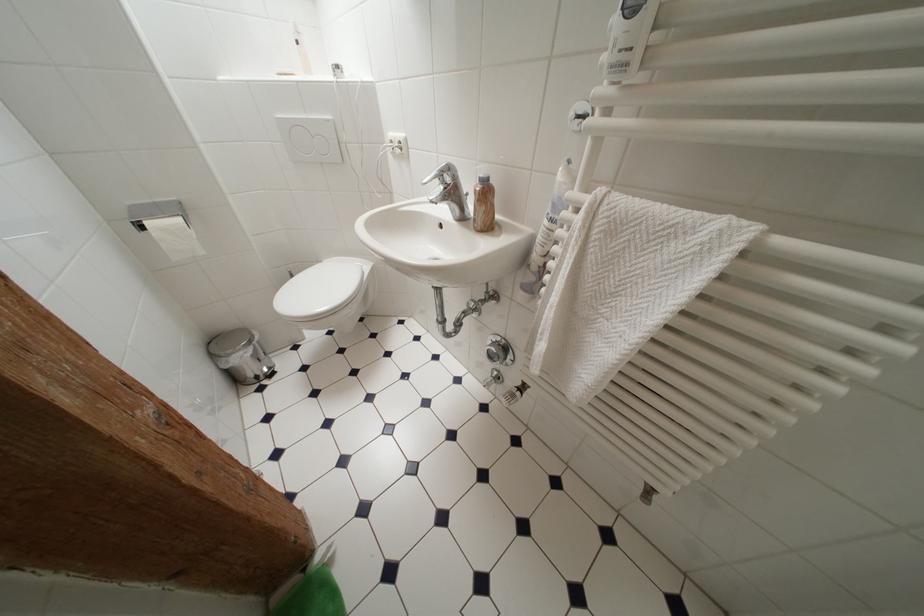
Where is `white toilet lid`? white toilet lid is located at coordinates (319, 291).